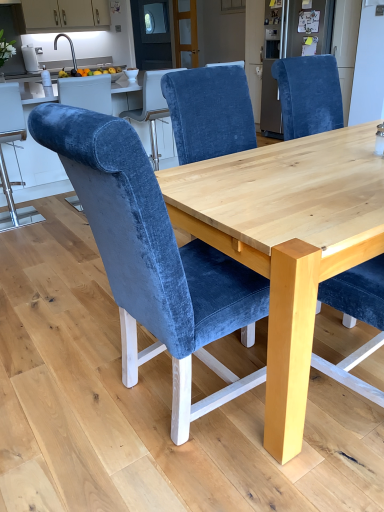
Identify the location of vacant area situated below velvet blue chair at center, the third chair positioned from the back (from a real-world perspective). The height and width of the screenshot is (512, 384). (156, 407).